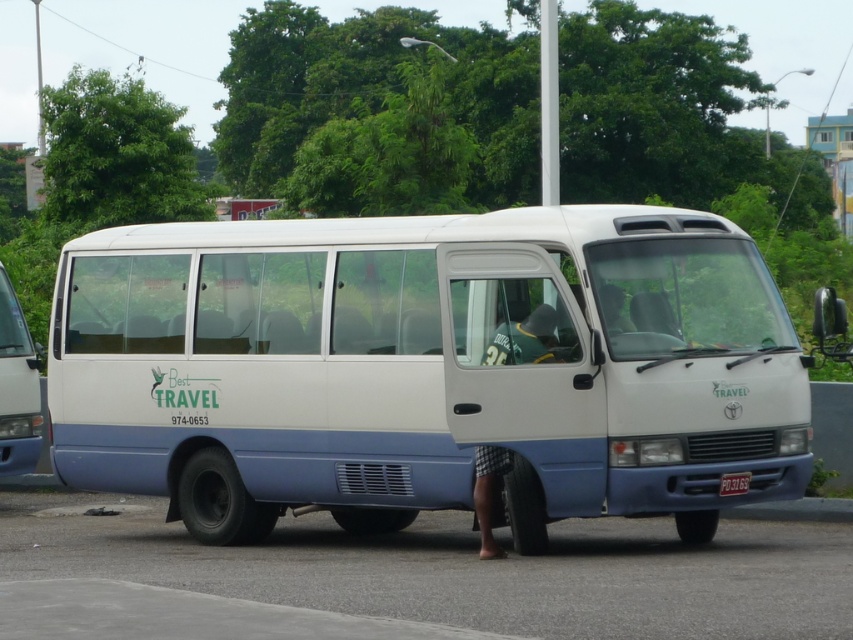
Can you confirm if white matte van at center is positioned above white plastic license plate at center?

Indeed, white matte van at center is positioned over white plastic license plate at center.

Where is `white matte van at center`? white matte van at center is located at coordinates (427, 368).

Who is taller, white matte van at center or white matte van at left?

With more height is white matte van at center.

Is white matte van at center below white matte van at left?

No, white matte van at center is not below white matte van at left.

Between point (521, 548) and point (12, 362), which one is positioned behind?

The point (12, 362) is more distant.

Image resolution: width=853 pixels, height=640 pixels. Identify the location of white matte van at center. (427, 368).

Is point (33, 458) farther from camera compared to point (721, 474)?

Yes.

Does white matte van at left have a lesser width compared to white plastic license plate at center?

Incorrect, white matte van at left's width is not less than white plastic license plate at center's.

Identify the location of white matte van at left. The image size is (853, 640). (16, 387).